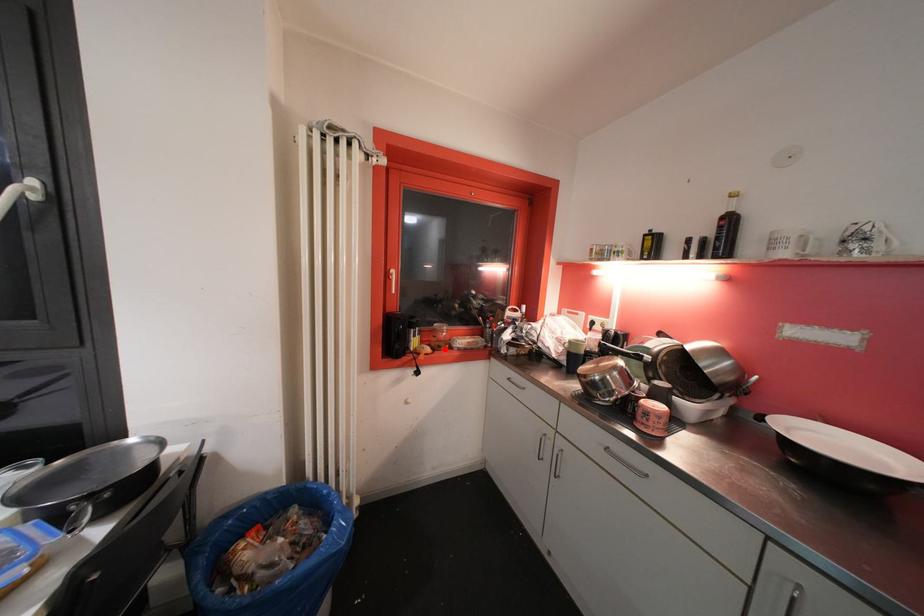
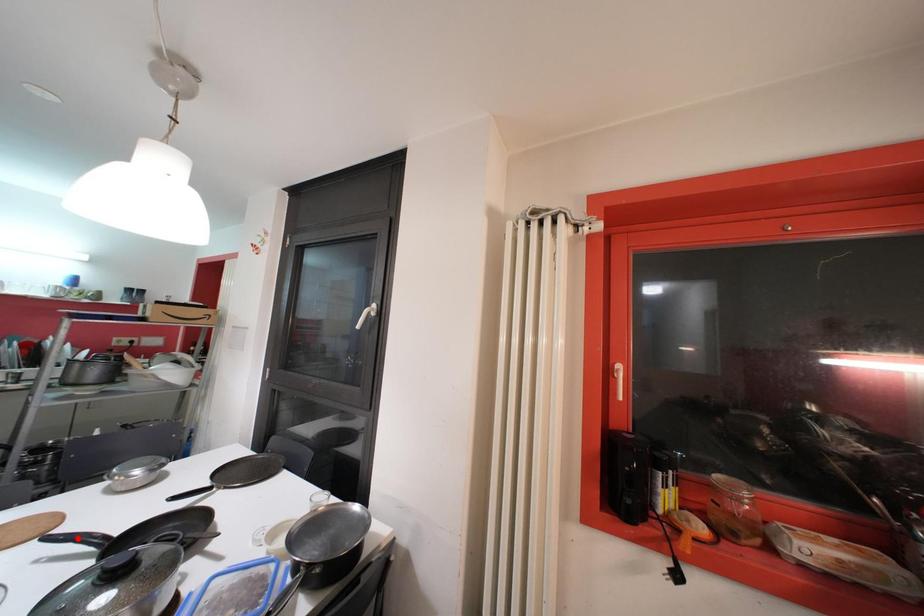
I am providing you with two images of the same scene from different viewpoints. A red point is marked on the first image and another point is marked on the second image. Is the marked point in image1 the same physical position as the marked point in image2?

No